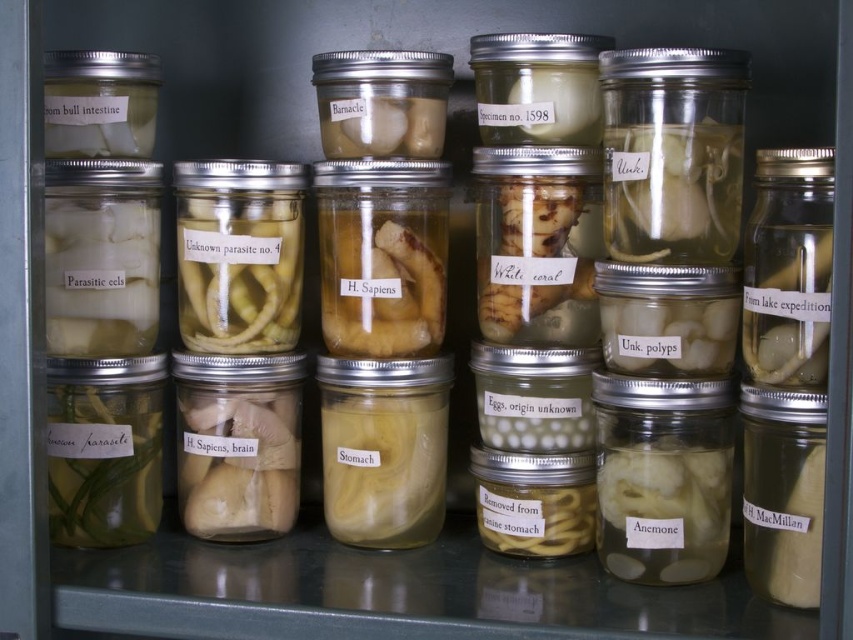
Between point (712, 524) and point (804, 326), which one is positioned in front?

Point (804, 326) is more forward.

Does translucent gelatinous anemone at center have a lesser height compared to translucent gelatinous substance at right?

Yes, translucent gelatinous anemone at center is shorter than translucent gelatinous substance at right.

Image resolution: width=853 pixels, height=640 pixels. Describe the element at coordinates (663, 499) in the screenshot. I see `translucent gelatinous anemone at center` at that location.

Where is `translucent gelatinous anemone at center`? This screenshot has width=853, height=640. translucent gelatinous anemone at center is located at coordinates (663, 499).

Is point (340, 428) positioned behind point (149, 109)?

Yes, point (340, 428) is farther from viewer.

Find the location of `translucent gelatinous stomach at center`. translucent gelatinous stomach at center is located at coordinates (383, 465).

Is translucent gelatinous polyps at center smaller than white matte bull intestine at upper left?

Incorrect, translucent gelatinous polyps at center is not smaller in size than white matte bull intestine at upper left.

Is point (648, 348) farther from camera compared to point (57, 116)?

No.

Who is more forward, (654, 356) or (132, 109)?

Point (654, 356) is in front.

This screenshot has height=640, width=853. In order to click on translucent gelatinous polyps at center in this screenshot , I will do `click(668, 333)`.